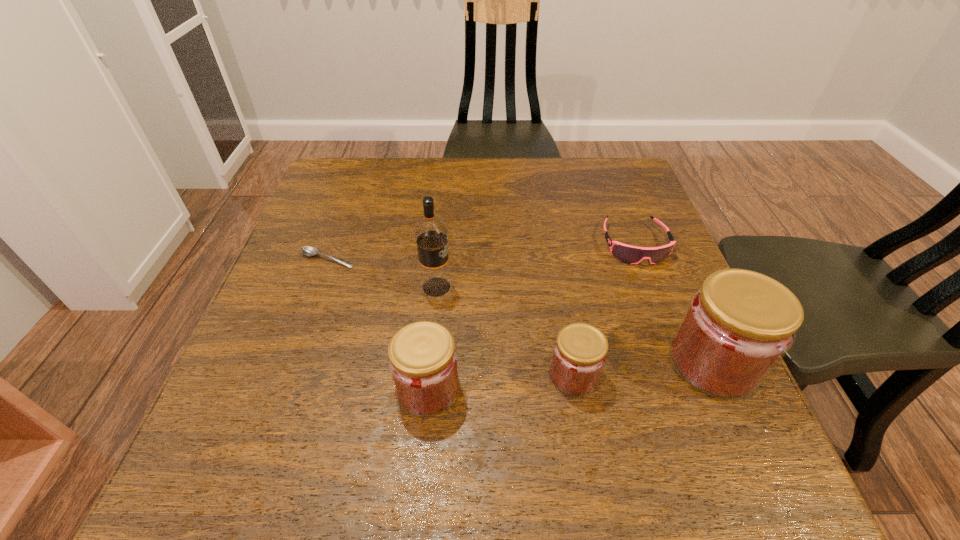
You are a GUI agent. You are given a task and a screenshot of the screen. Output one action in this format:
    pyautogui.click(x=<x>, y=<y>)
    Task: Click on the third tallest object
    The width and height of the screenshot is (960, 540).
    Given the screenshot: What is the action you would take?
    pyautogui.click(x=423, y=361)

Locate an element on the screen. the second shortest jam is located at coordinates (423, 361).

Where is `the second jam from right to left`? Image resolution: width=960 pixels, height=540 pixels. the second jam from right to left is located at coordinates (580, 351).

Find the location of a particular element. the shortest jam is located at coordinates (580, 351).

You are a GUI agent. You are given a task and a screenshot of the screen. Output one action in this format:
    pyautogui.click(x=<x>, y=<y>)
    Task: Click on the tallest jam
    
    Given the screenshot: What is the action you would take?
    pyautogui.click(x=739, y=324)

The height and width of the screenshot is (540, 960). I want to click on the rightmost jam, so click(739, 324).

Identify the location of the leftmost object. This screenshot has height=540, width=960. (307, 250).

What are the coordinates of `soupspoon` in the screenshot? It's located at (307, 250).

Identify the location of the tallest object. (430, 233).

You are a GUI agent. You are given a task and a screenshot of the screen. Output one action in this format:
    pyautogui.click(x=<x>, y=<y>)
    Task: Click on the third farthest object
    This screenshot has height=540, width=960.
    Given the screenshot: What is the action you would take?
    pyautogui.click(x=430, y=233)